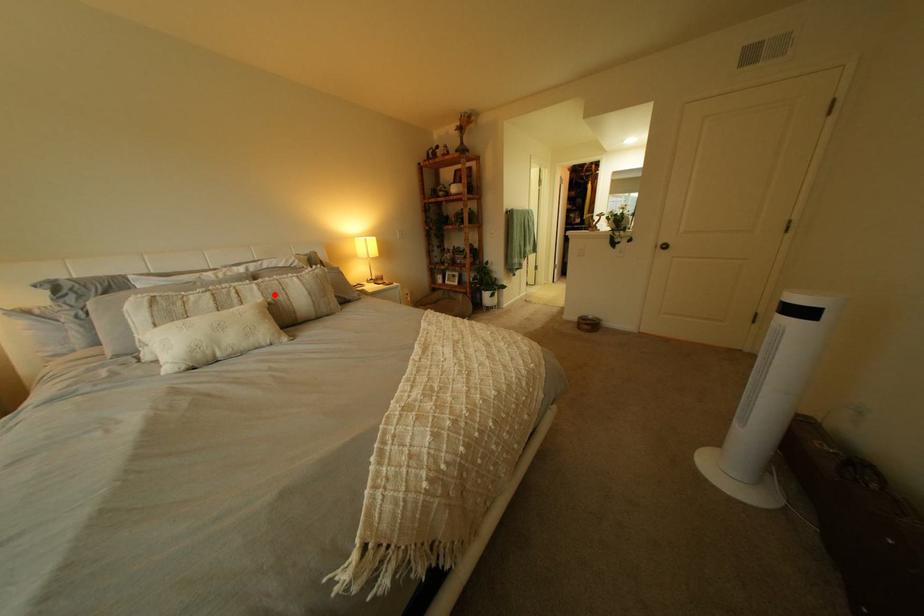
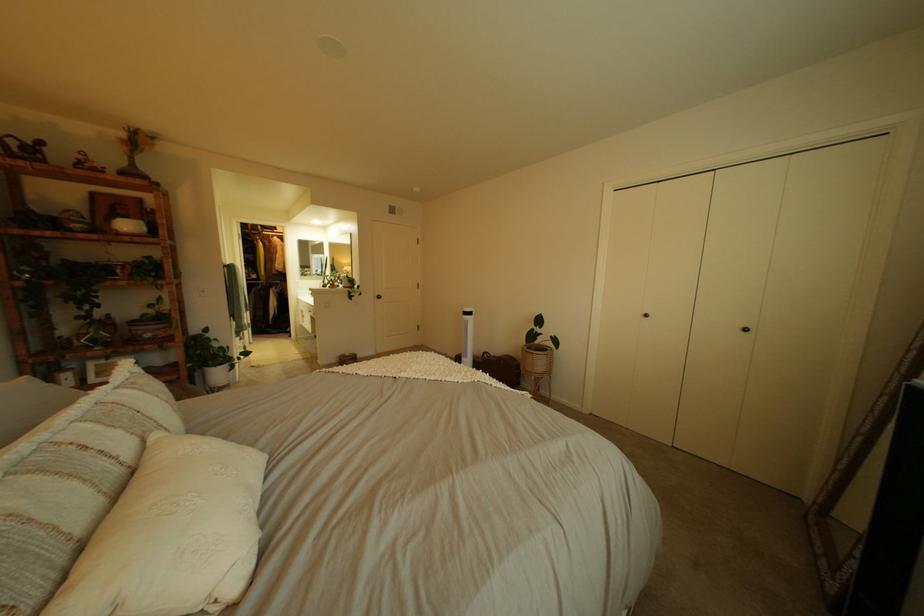
Find the pixel in the second image that matches the highlighted location in the first image.

(134, 434)